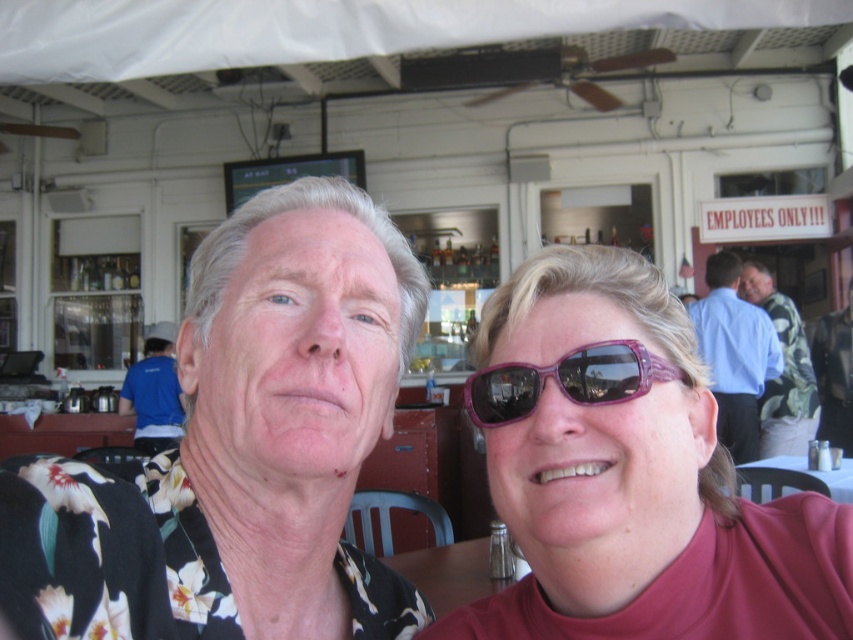
Question: Among these points, which one is farthest from the camera?

Choices:
 (A) (762, 428)
 (B) (120, 410)
 (C) (206, 595)

Answer: (B)

Question: Can you confirm if floral shirt at left is positioned to the right of blue shirt at left?

Choices:
 (A) yes
 (B) no

Answer: (A)

Question: Which point is closer to the camera?

Choices:
 (A) (711, 291)
 (B) (511, 300)

Answer: (B)

Question: Which point is farther to the camera?

Choices:
 (A) purple glossy sunglasses at center
 (B) green leafy shirt at right

Answer: (B)

Question: Can you confirm if blue shirt at right is positioned below green leafy shirt at right?

Choices:
 (A) no
 (B) yes

Answer: (B)

Question: Can you confirm if green leafy shirt at right is smaller than blue shirt at left?

Choices:
 (A) yes
 (B) no

Answer: (A)